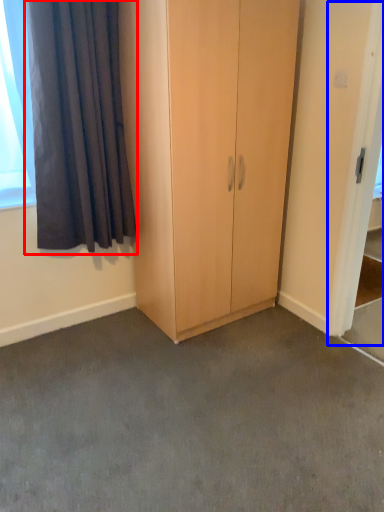
Question: Which point is further to the camera, curtain (highlighted by a red box) or screen door (highlighted by a blue box)?

Choices:
 (A) curtain
 (B) screen door

Answer: (A)